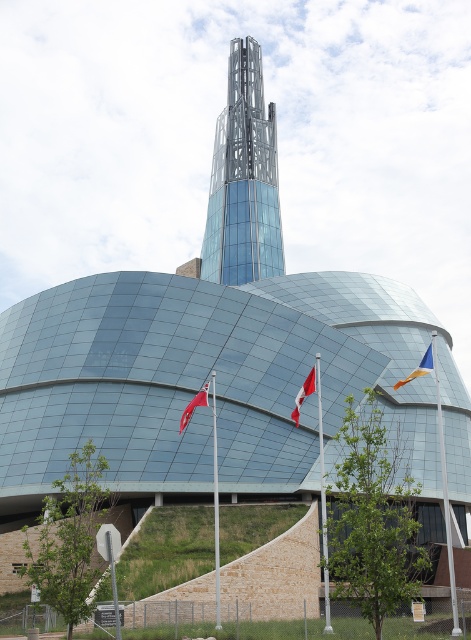
Question: Is red fabric flag at center further to the viewer compared to red fabric flag at lower center?

Choices:
 (A) yes
 (B) no

Answer: (A)

Question: Which of these objects is positioned closest to the red fabric flag at center?

Choices:
 (A) orange fabric flag at right
 (B) transparent glass tower at center
 (C) red fabric flag at lower center

Answer: (C)

Question: From the image, what is the correct spatial relationship of red fabric flag at center in relation to red fabric flag at lower center?

Choices:
 (A) below
 (B) above

Answer: (B)

Question: Considering the real-world distances, which object is closest to the orange fabric flag at right?

Choices:
 (A) red fabric flag at center
 (B) red fabric flag at lower center

Answer: (A)

Question: Based on their relative distances, which object is nearer to the red fabric flag at lower center?

Choices:
 (A) transparent glass tower at center
 (B) orange fabric flag at right
 (C) red fabric flag at center

Answer: (C)

Question: Is red fabric flag at center further to the viewer compared to red fabric flag at lower center?

Choices:
 (A) no
 (B) yes

Answer: (B)